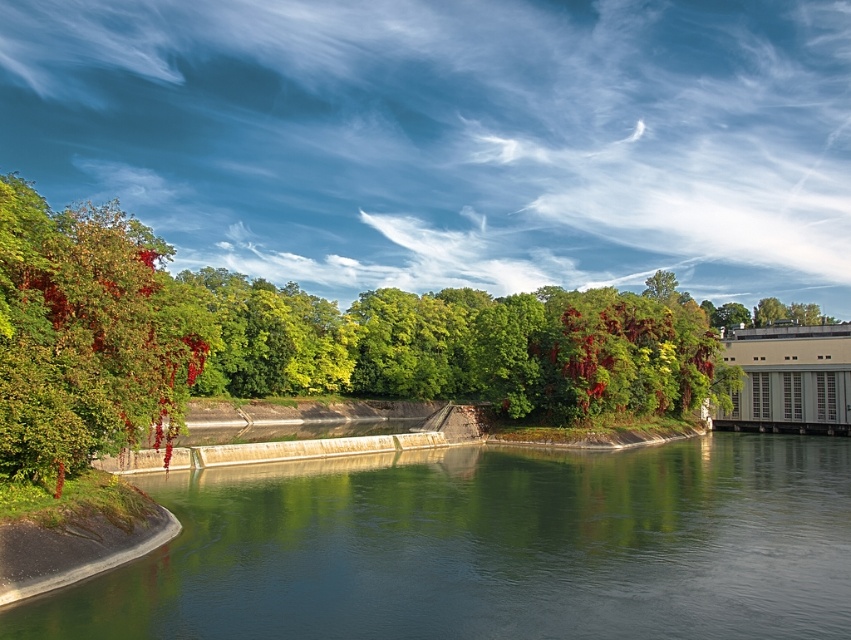
Does green concrete river at lower left lie in front of shiny red berries at left?

Yes, it is.

How much distance is there between green concrete river at lower left and shiny red berries at left?

The distance of green concrete river at lower left from shiny red berries at left is 20.29 meters.

Between point (437, 561) and point (73, 324), which one is positioned behind?

The point (73, 324) is more distant.

Identify the location of green concrete river at lower left. Image resolution: width=851 pixels, height=640 pixels. [x=489, y=547].